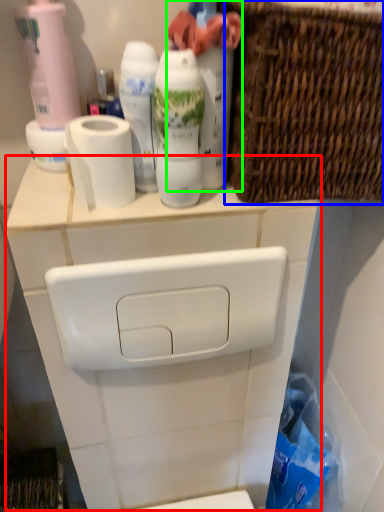
Question: Which object is the closest to the counter (highlighted by a red box)? Choose among these: basket (highlighted by a blue box) or cleaning product (highlighted by a green box).

Choices:
 (A) basket
 (B) cleaning product

Answer: (A)